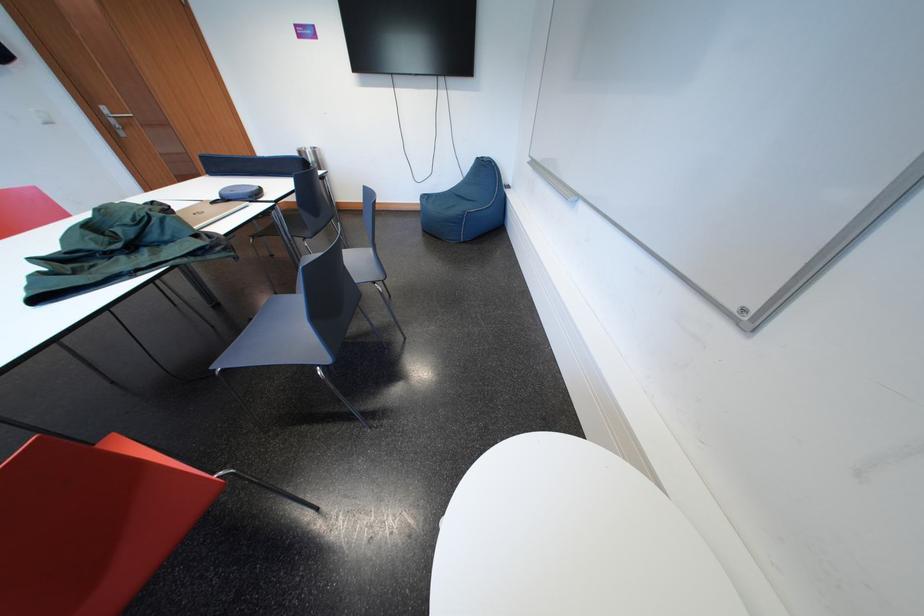
Locate an element on the screen. This screenshot has width=924, height=616. metal cylinder cup is located at coordinates (311, 156).